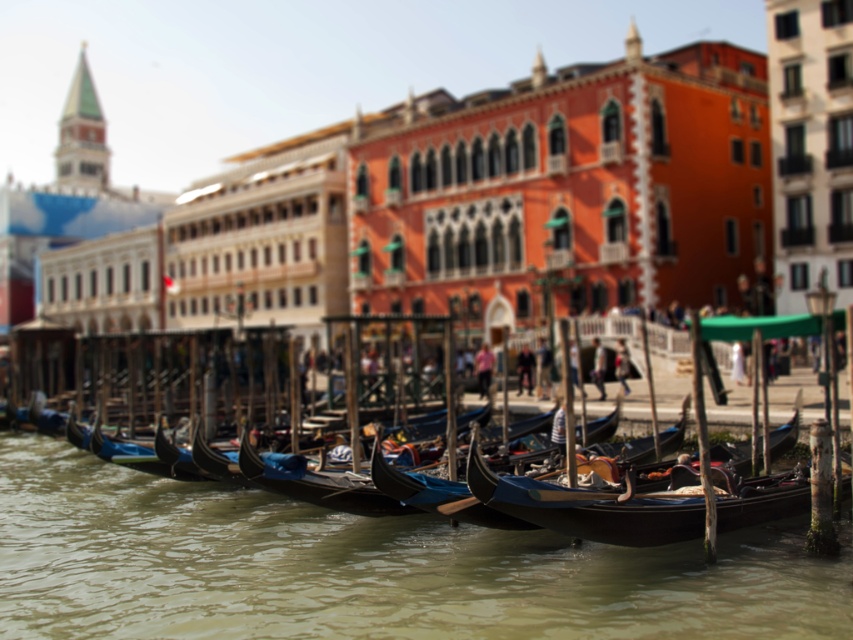
Question: Can you confirm if greenish water at lower center is positioned to the right of shiny black gondola at center?

Choices:
 (A) yes
 (B) no

Answer: (B)

Question: Can you confirm if greenish water at lower center is bigger than shiny black gondola at center?

Choices:
 (A) yes
 (B) no

Answer: (A)

Question: Which point is farther to the camera?

Choices:
 (A) greenish water at lower center
 (B) shiny black gondola at center

Answer: (B)

Question: Which point is closer to the camera?

Choices:
 (A) (663, 534)
 (B) (328, 582)

Answer: (A)

Question: Among these points, which one is nearest to the camera?

Choices:
 (A) (715, 512)
 (B) (503, 611)

Answer: (B)

Question: Considering the relative positions of greenish water at lower center and shiny black gondola at center in the image provided, where is greenish water at lower center located with respect to shiny black gondola at center?

Choices:
 (A) above
 (B) below

Answer: (B)